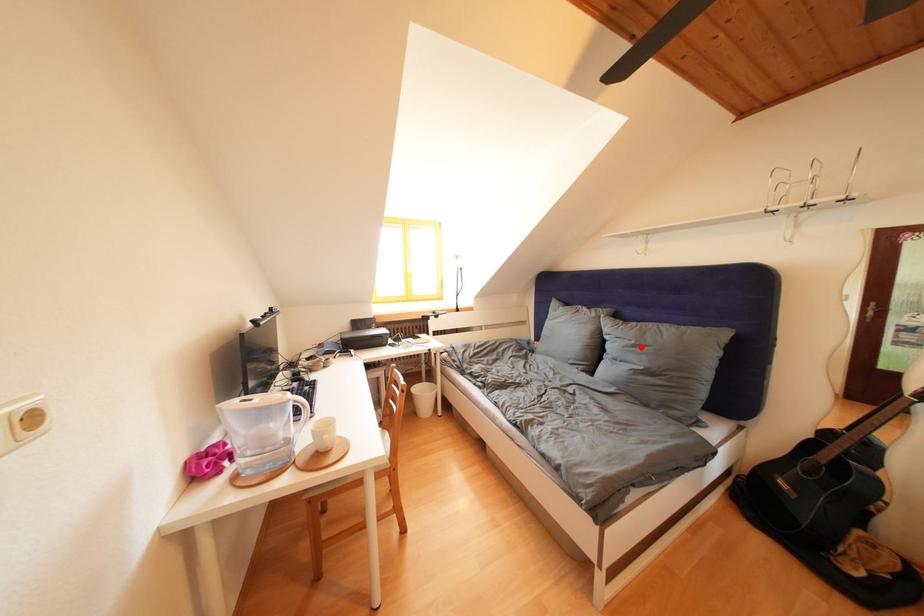
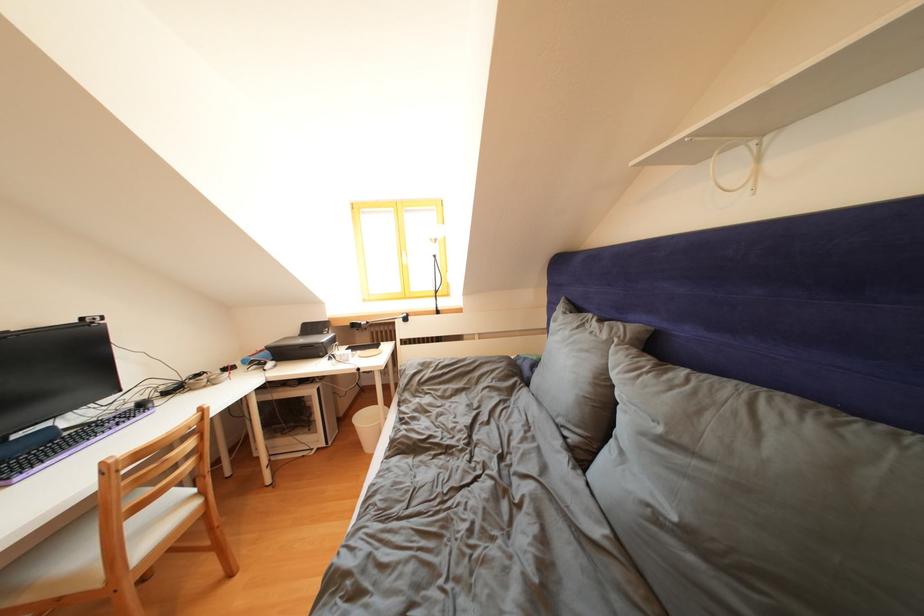
Find the pixel in the second image that matches the highlighted location in the first image.

(667, 435)